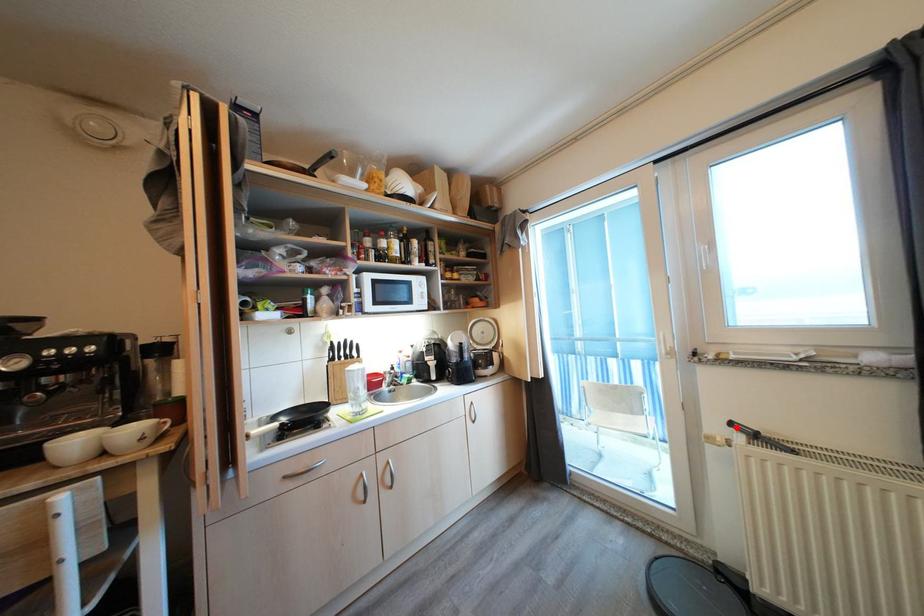
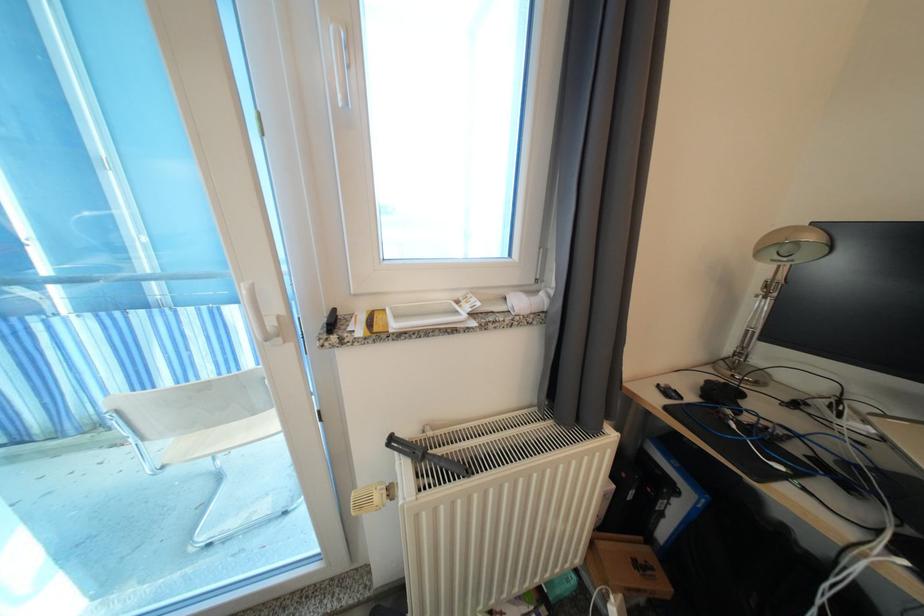
The point at the highlighted location is marked in the first image. Where is the corresponding point in the second image?

(395, 445)